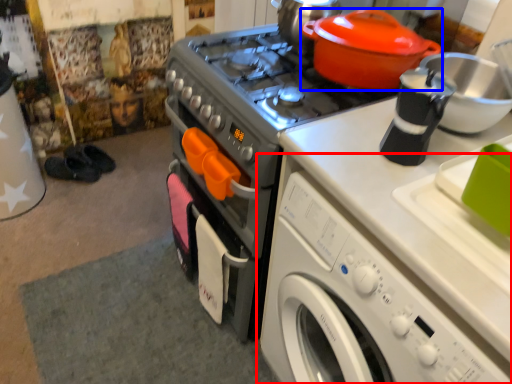
Question: Which object is further to the camera taking this photo, washing machine (highlighted by a red box) or kitchen appliance (highlighted by a blue box)?

Choices:
 (A) washing machine
 (B) kitchen appliance

Answer: (B)